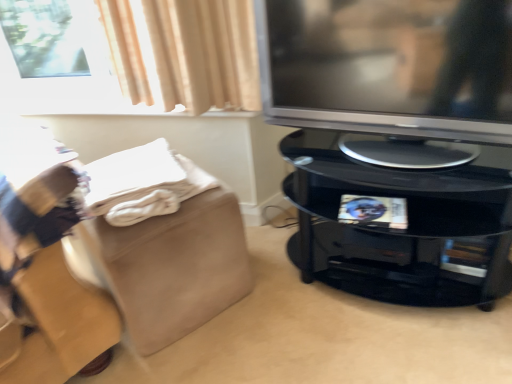
Question: In terms of size, does satin silver television at right appear bigger or smaller than beige suede footrest at lower left?

Choices:
 (A) small
 (B) big

Answer: (A)

Question: Relative to beige suede footrest at lower left, is satin silver television at right in front or behind?

Choices:
 (A) front
 (B) behind

Answer: (A)

Question: Which object is positioned closest to the satin silver television at right?

Choices:
 (A) beige suede footrest at lower left
 (B) glossy black tv stand at right
 (C) white soft blanket at lower left

Answer: (B)

Question: Which is farther from the beige suede footrest at lower left?

Choices:
 (A) white soft blanket at lower left
 (B) glossy black tv stand at right
 (C) satin silver television at right

Answer: (C)